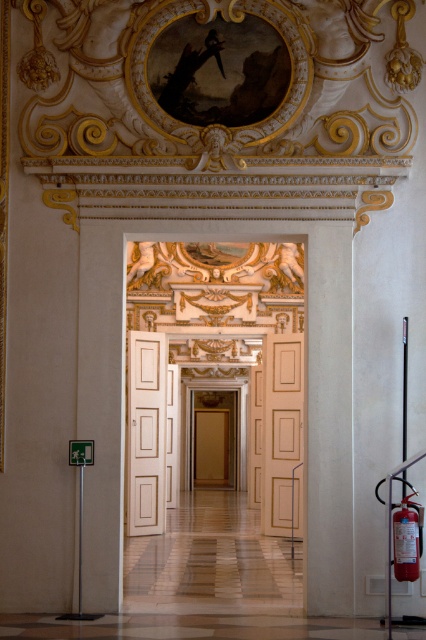
Question: Does white glossy door at center have a lesser width compared to red matte fire extinguisher at lower right?

Choices:
 (A) no
 (B) yes

Answer: (A)

Question: Does white glossy door at center appear under red matte fire extinguisher at lower right?

Choices:
 (A) yes
 (B) no

Answer: (A)

Question: Does white glossy door at center have a greater width compared to red matte fire extinguisher at lower right?

Choices:
 (A) no
 (B) yes

Answer: (B)

Question: Among these points, which one is farthest from the camera?

Choices:
 (A) (276, 488)
 (B) (399, 513)

Answer: (A)